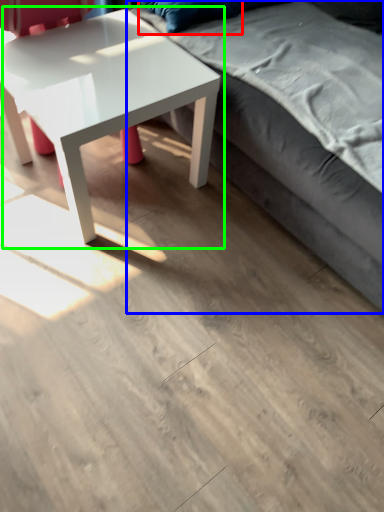
Question: Which object is the closest to the pillow (highlighted by a red box)? Choose among these: studio couch (highlighted by a blue box) or coffee table (highlighted by a green box).

Choices:
 (A) studio couch
 (B) coffee table

Answer: (B)